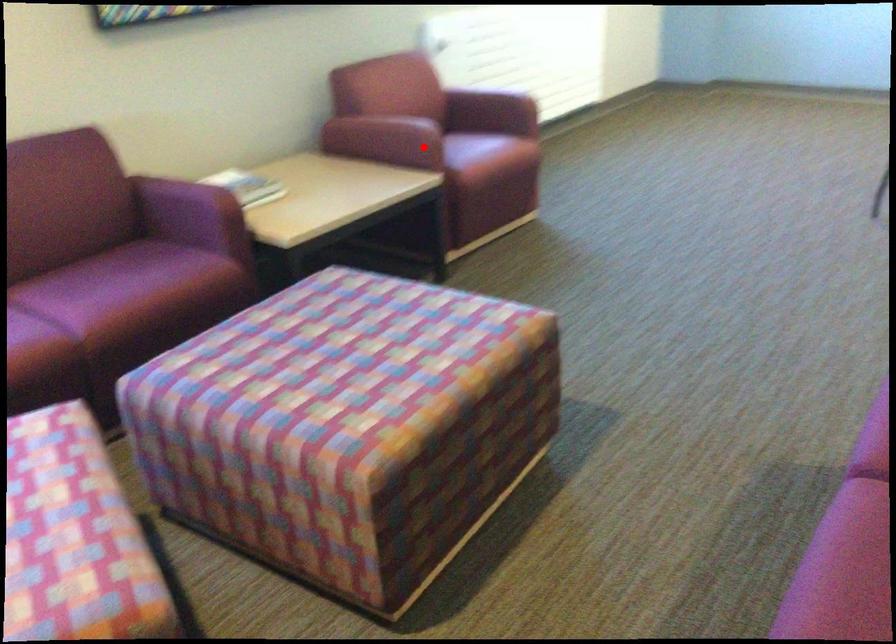
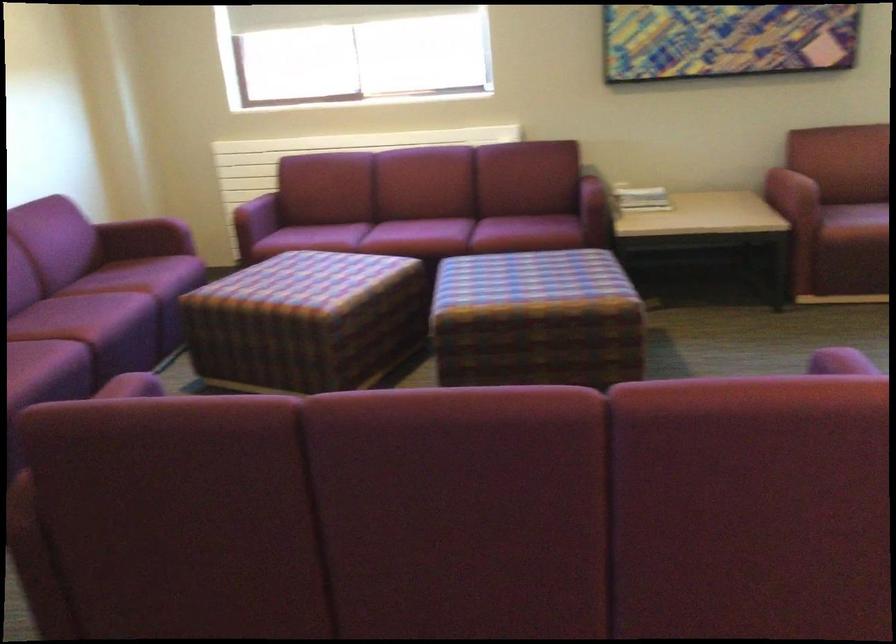
Question: I am providing you with two images of the same scene from different viewpoints. A red point is shown in image1. For the corresponding object point in image2, is it positioned nearer or farther from the camera?

Choices:
 (A) Nearer
 (B) Farther

Answer: (B)